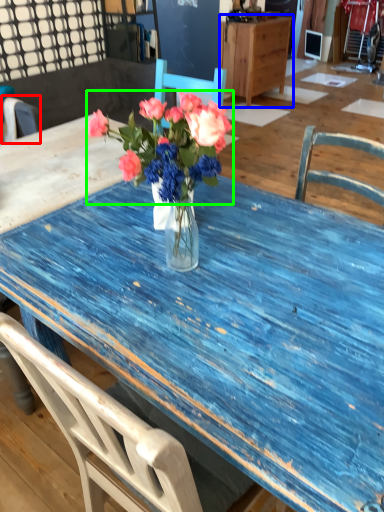
Question: Estimate the real-world distances between objects in this image. Which object is closer to chair (highlighted by a red box), cabinetry (highlighted by a blue box) or flower (highlighted by a green box)?

Choices:
 (A) cabinetry
 (B) flower

Answer: (B)